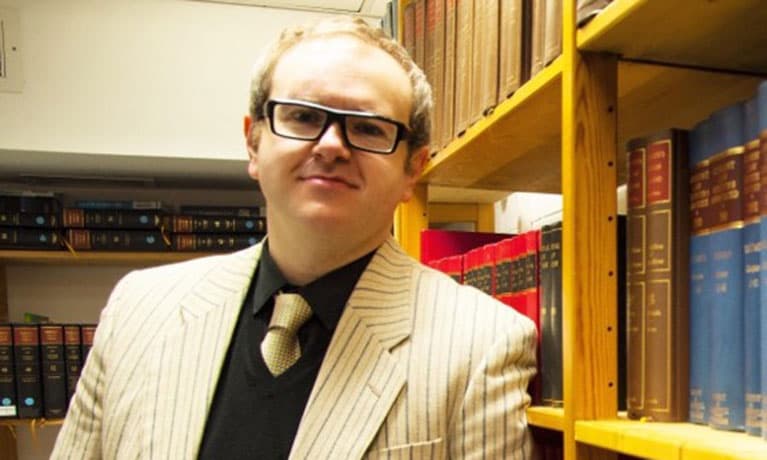
This screenshot has height=460, width=767. Identify the location of wall. (150, 57).